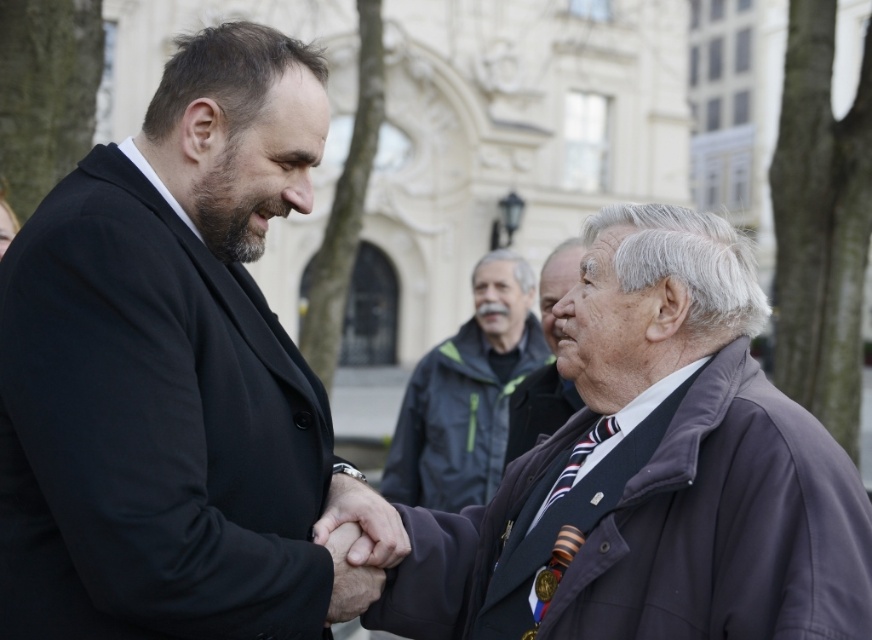
Question: Can you confirm if black matte suit at center is positioned to the left of dark gray jacket at center?

Choices:
 (A) no
 (B) yes

Answer: (B)

Question: Which object is the farthest from the dark brown leather jacket at center?

Choices:
 (A) striped fabric tie at center
 (B) dark gray jacket at center

Answer: (B)

Question: Can you confirm if black matte suit at center is thinner than smooth leather hand at center?

Choices:
 (A) yes
 (B) no

Answer: (B)

Question: Which of the following is the farthest from the observer?

Choices:
 (A) (595, 460)
 (B) (802, 584)

Answer: (A)

Question: Among these points, which one is nearest to the camera?

Choices:
 (A) (377, 547)
 (B) (131, 467)

Answer: (B)

Question: Is smooth leather hand at center above smooth skin hand at center?

Choices:
 (A) yes
 (B) no

Answer: (A)